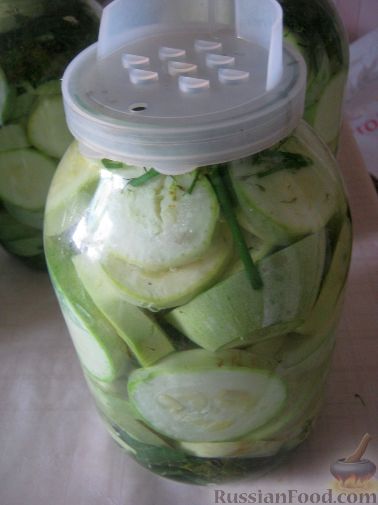
Locate an element on the screen. table is located at coordinates (31, 410), (366, 207).